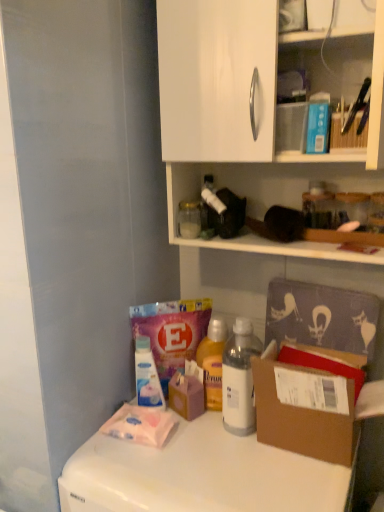
Question: From the image's perspective, is white plastic bottle at center, the second bottle ordered from the bottom, beneath clear glass jar at upper center, the 3th bottle when ordered from bottom to top?

Choices:
 (A) yes
 (B) no

Answer: (A)

Question: Could clear glass jar at upper center, acting as the second bottle starting from the left, be considered to be inside white plastic bottle at center, the third bottle when ordered from left to right?

Choices:
 (A) no
 (B) yes

Answer: (A)

Question: Does white plastic bottle at center, the second bottle ordered from the bottom, turn towards clear glass jar at upper center, acting as the second bottle starting from the left?

Choices:
 (A) no
 (B) yes

Answer: (A)

Question: Is white plastic bottle at center, the second bottle ordered from the bottom, thinner than clear glass jar at upper center, the second bottle from the right?

Choices:
 (A) yes
 (B) no

Answer: (B)

Question: Is white plastic bottle at center, the third bottle when ordered from left to right, at the right side of clear glass jar at upper center, the 3th bottle when ordered from bottom to top?

Choices:
 (A) yes
 (B) no

Answer: (A)

Question: Considering the positions of brown cardboard box at lower right and transparent plastic bottle at lower center, arranged as the third bottle when viewed from the top, in the image, is brown cardboard box at lower right bigger or smaller than transparent plastic bottle at lower center, arranged as the third bottle when viewed from the top,?

Choices:
 (A) big
 (B) small

Answer: (A)

Question: From the image's perspective, is brown cardboard box at lower right located above or below transparent plastic bottle at lower center, arranged as the third bottle when viewed from the top?

Choices:
 (A) below
 (B) above

Answer: (A)

Question: Do you think brown cardboard box at lower right is within transparent plastic bottle at lower center, the 3th bottle in the right-to-left sequence, or outside of it?

Choices:
 (A) inside
 (B) outside

Answer: (B)

Question: Would you say brown cardboard box at lower right is to the left or to the right of transparent plastic bottle at lower center, the 3th bottle in the right-to-left sequence, in the picture?

Choices:
 (A) right
 (B) left

Answer: (A)

Question: In the image, is white glossy counter top at lower left positioned in front of or behind clear glass jar at upper center, the second bottle from the right?

Choices:
 (A) behind
 (B) front

Answer: (B)

Question: From the image's perspective, is white glossy counter top at lower left located above or below clear glass jar at upper center, acting as the second bottle starting from the left?

Choices:
 (A) below
 (B) above

Answer: (A)

Question: Is white glossy counter top at lower left taller or shorter than clear glass jar at upper center, which is counted as the first bottle, starting from the top?

Choices:
 (A) short
 (B) tall

Answer: (B)

Question: In terms of width, does white glossy counter top at lower left look wider or thinner when compared to clear glass jar at upper center, acting as the second bottle starting from the left?

Choices:
 (A) thin
 (B) wide

Answer: (B)

Question: Is white glossy counter top at lower left inside the boundaries of brown cardboard box at lower right, or outside?

Choices:
 (A) outside
 (B) inside

Answer: (A)

Question: Visually, is white glossy counter top at lower left positioned to the left or to the right of brown cardboard box at lower right?

Choices:
 (A) left
 (B) right

Answer: (A)